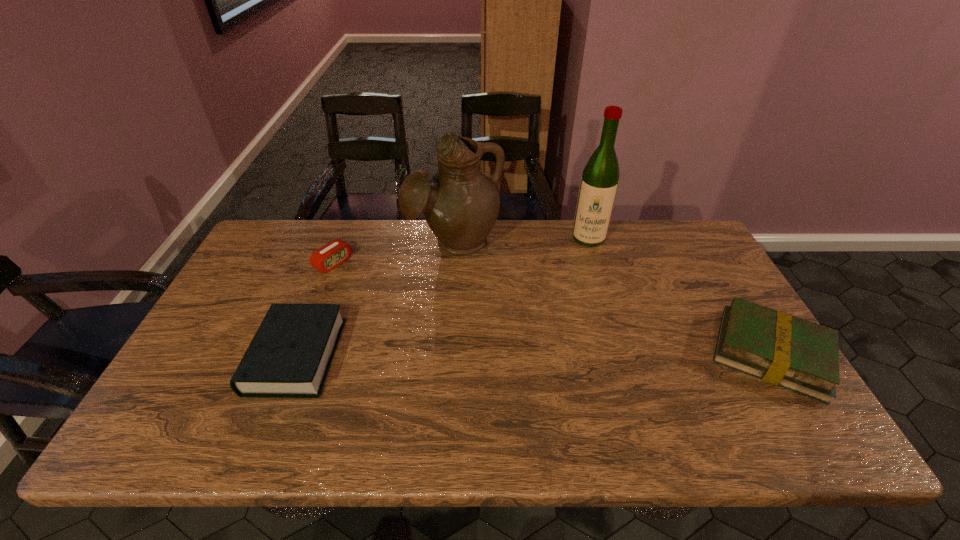
The image size is (960, 540). I want to click on Bible, so click(290, 355).

The image size is (960, 540). Find the location of `the rightmost object`. the rightmost object is located at coordinates (787, 351).

Where is `the fourth object from left to right`? The image size is (960, 540). the fourth object from left to right is located at coordinates (600, 178).

Locate an element on the screen. The width and height of the screenshot is (960, 540). the fourth shortest object is located at coordinates (460, 204).

Where is `pitcher`? pitcher is located at coordinates (460, 204).

Find the location of a particular element. alarm clock is located at coordinates (331, 255).

Find the location of `vacant area situated on the back of the Bible`. vacant area situated on the back of the Bible is located at coordinates (331, 265).

Locate an element on the screen. The width and height of the screenshot is (960, 540). free region located 0.260m on the back of the book is located at coordinates (709, 253).

Find the location of a particular element. The height and width of the screenshot is (540, 960). blank space located on the label of the liquor is located at coordinates (583, 315).

Identify the location of free location located on the label of the liquor. (582, 340).